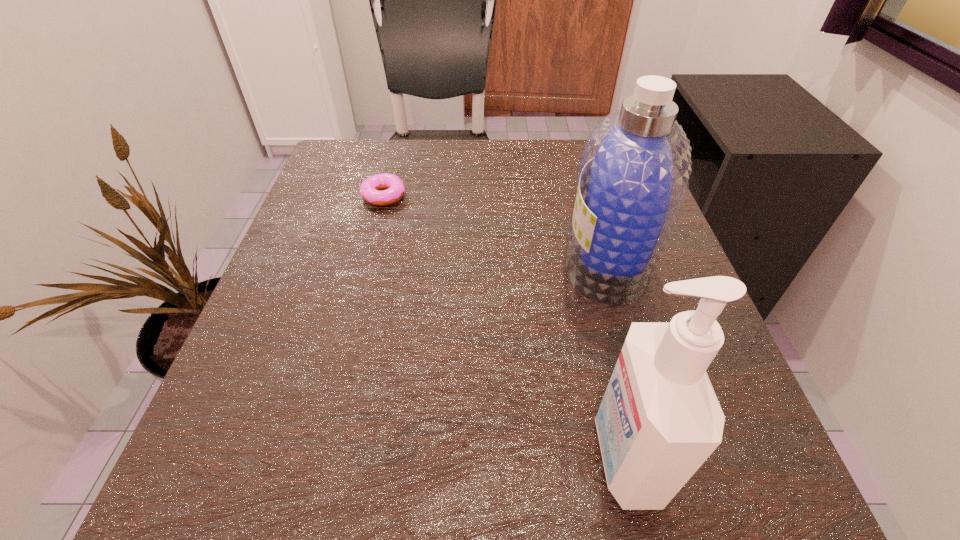
The width and height of the screenshot is (960, 540). I want to click on empty space that is in between the shortest object and the second nearest object, so click(x=495, y=230).

At what (x,y) coordinates should I click in order to perform the action: click on free area in between the second farthest object and the nearer cleansing agent. Please return your answer as a coordinate pair (x, y). The height and width of the screenshot is (540, 960). Looking at the image, I should click on [x=615, y=359].

Locate an element on the screen. Image resolution: width=960 pixels, height=540 pixels. empty space that is in between the nearest object and the shortest object is located at coordinates (504, 326).

Find the location of a particular element. This screenshot has width=960, height=540. vacant space that is in between the nearest object and the farther cleansing agent is located at coordinates (615, 359).

Where is `empty location between the farther cleansing agent and the leftmost object`? empty location between the farther cleansing agent and the leftmost object is located at coordinates (495, 230).

In order to click on blank region between the farther cleansing agent and the doughnut in this screenshot , I will do `click(495, 230)`.

You are a GUI agent. You are given a task and a screenshot of the screen. Output one action in this format:
    pyautogui.click(x=<x>, y=<y>)
    Task: Click on the vacant region between the farther cleansing agent and the farthest object
    
    Given the screenshot: What is the action you would take?
    coord(495,230)

Locate an element on the screen. vacant area between the nearest object and the farther cleansing agent is located at coordinates (615, 359).

At what (x,y) coordinates should I click in order to perform the action: click on object that is the closest to the farthest object. Please return your answer as a coordinate pair (x, y). Looking at the image, I should click on (635, 167).

The height and width of the screenshot is (540, 960). I want to click on the closest object to the doughnut, so click(635, 167).